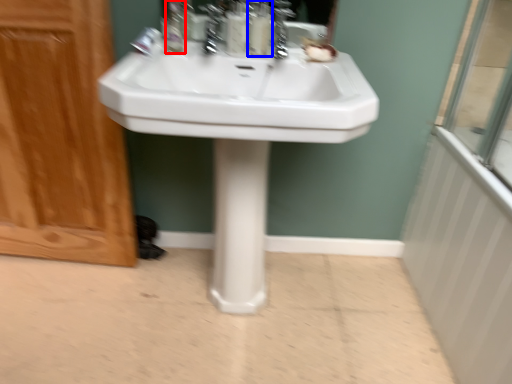
Question: Which of the following is the closest to the observer, mouthwash (highlighted by a red box) or soap dispenser (highlighted by a blue box)?

Choices:
 (A) mouthwash
 (B) soap dispenser

Answer: (A)